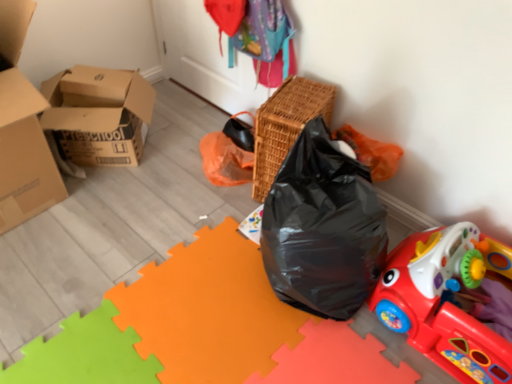
Question: Should I look upward or downward to see woven brown basket at upper center?

Choices:
 (A) up
 (B) down

Answer: (A)

Question: From the image's perspective, would you say rubberized plastic toy car at lower right is positioned over woven brown basket at upper center?

Choices:
 (A) no
 (B) yes

Answer: (A)

Question: Does rubberized plastic toy car at lower right have a lesser height compared to woven brown basket at upper center?

Choices:
 (A) no
 (B) yes

Answer: (B)

Question: Does rubberized plastic toy car at lower right turn towards woven brown basket at upper center?

Choices:
 (A) no
 (B) yes

Answer: (A)

Question: From a real-world perspective, is rubberized plastic toy car at lower right under woven brown basket at upper center?

Choices:
 (A) no
 (B) yes

Answer: (B)

Question: Is rubberized plastic toy car at lower right placed right next to woven brown basket at upper center?

Choices:
 (A) yes
 (B) no

Answer: (B)

Question: Considering the relative positions of rubberized plastic toy car at lower right and woven brown basket at upper center in the image provided, is rubberized plastic toy car at lower right to the right of woven brown basket at upper center from the viewer's perspective?

Choices:
 (A) yes
 (B) no

Answer: (A)

Question: Is woven brown basket at upper center surrounding cardboard boxes at left?

Choices:
 (A) yes
 (B) no

Answer: (B)

Question: From the image's perspective, does woven brown basket at upper center appear lower than cardboard boxes at left?

Choices:
 (A) yes
 (B) no

Answer: (A)

Question: Is woven brown basket at upper center bigger than cardboard boxes at left?

Choices:
 (A) yes
 (B) no

Answer: (B)

Question: Is woven brown basket at upper center thinner than cardboard boxes at left?

Choices:
 (A) yes
 (B) no

Answer: (A)

Question: From the image's perspective, is woven brown basket at upper center located above cardboard boxes at left?

Choices:
 (A) no
 (B) yes

Answer: (A)

Question: Does woven brown basket at upper center lie in front of cardboard boxes at left?

Choices:
 (A) yes
 (B) no

Answer: (A)

Question: Is the depth of woven brown basket at upper center less than that of rubberized plastic toy car at lower right?

Choices:
 (A) yes
 (B) no

Answer: (B)